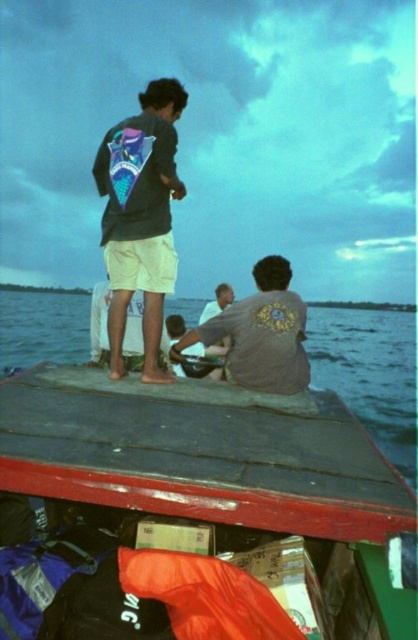
Question: Is smooth wooden boat at center wider than matte gray shirt at center?

Choices:
 (A) no
 (B) yes

Answer: (B)

Question: Is smooth wooden boat at center to the left of matte gray shirt at center from the viewer's perspective?

Choices:
 (A) no
 (B) yes

Answer: (B)

Question: Estimate the real-world distances between objects in this image. Which object is closer to the matte black jacket at upper center?

Choices:
 (A) smooth wooden boat at center
 (B) blue water at center

Answer: (A)

Question: Does blue water at center appear under matte gray shirt at center?

Choices:
 (A) no
 (B) yes

Answer: (A)

Question: Which is nearer to the smooth wooden boat at center?

Choices:
 (A) gray matte shirt at center
 (B) matte gray shirt at center
 (C) blue water at center

Answer: (A)

Question: Which of the following is the closest to the observer?

Choices:
 (A) matte gray shirt at center
 (B) matte black jacket at upper center
 (C) smooth wooden boat at center
 (D) gray matte shirt at center

Answer: (C)